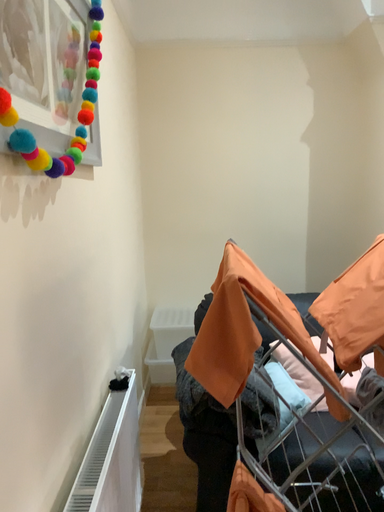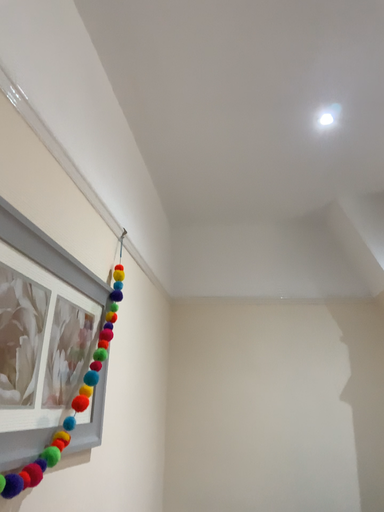
Question: How did the camera likely rotate when shooting the video?

Choices:
 (A) rotated upward
 (B) rotated downward

Answer: (A)